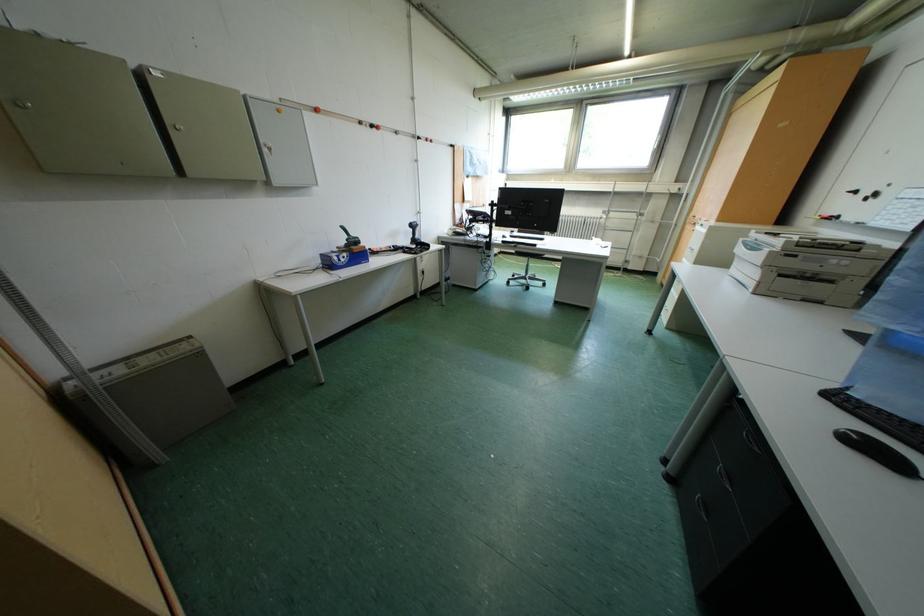
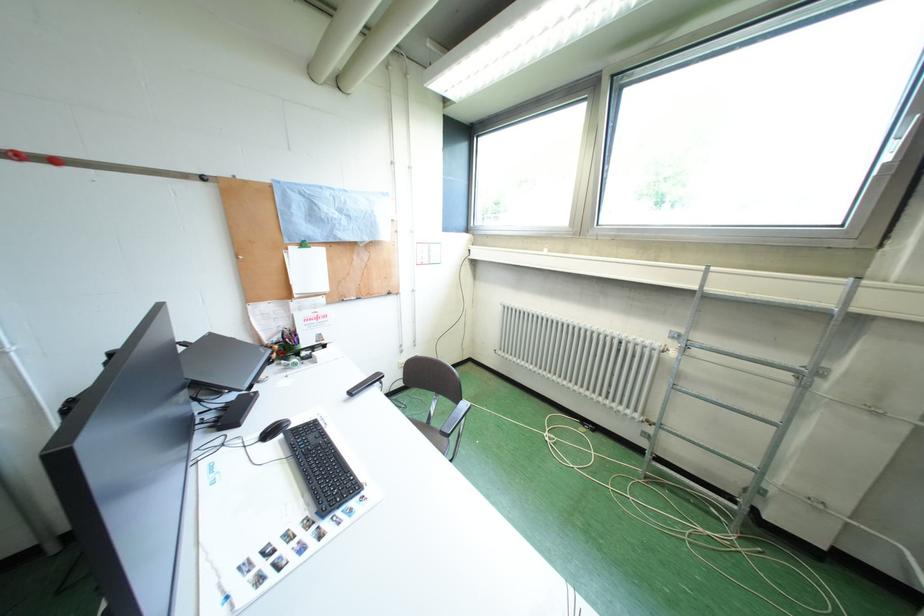
The images are taken continuously from a first-person perspective. In which direction are you moving?

The cameraman moved toward right, forward.